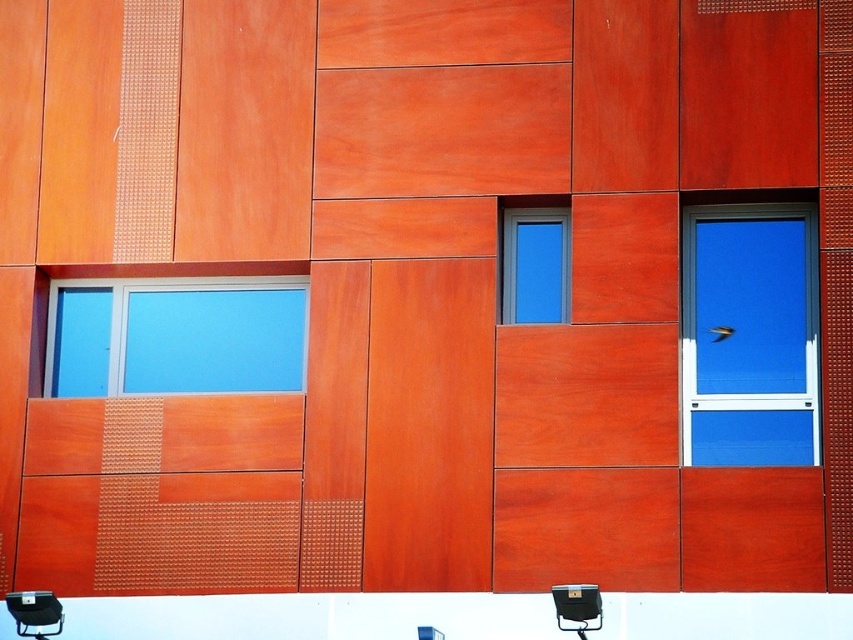
Question: Does blue glass window at left appear on the left side of black plastic chair at lower left?

Choices:
 (A) yes
 (B) no

Answer: (B)

Question: Which of the following is the farthest from the observer?

Choices:
 (A) metallic black chair at lower right
 (B) matte blue glass window at center
 (C) black plastic chair at lower left
 (D) blue glass window at left

Answer: (D)

Question: Which object is positioned closest to the black plastic chair at lower left?

Choices:
 (A) metallic black chair at lower right
 (B) blue glass window at left
 (C) matte blue glass window at center
 (D) blue glass window at center right

Answer: (B)

Question: Which point is farther to the camera?

Choices:
 (A) blue glass window at left
 (B) blue glass window at center right

Answer: (A)

Question: Can you confirm if blue glass window at left is smaller than matte blue glass window at center?

Choices:
 (A) yes
 (B) no

Answer: (B)

Question: Is blue glass window at center right to the left of metallic black chair at lower right from the viewer's perspective?

Choices:
 (A) yes
 (B) no

Answer: (B)